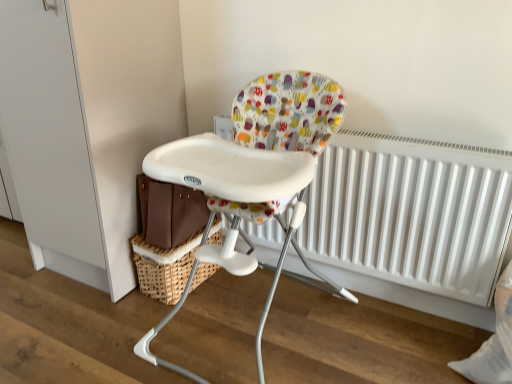
Question: Would you say white matte radiator at center is inside or outside woven brown basket at lower left?

Choices:
 (A) inside
 (B) outside

Answer: (B)

Question: From a real-world perspective, is white matte radiator at center physically located above or below woven brown basket at lower left?

Choices:
 (A) below
 (B) above

Answer: (B)

Question: Which of these objects is positioned closest to the woven brown basket at lower left?

Choices:
 (A) white matte radiator at center
 (B) white plastic highchair at center

Answer: (B)

Question: Which object is positioned closest to the white plastic highchair at center?

Choices:
 (A) woven brown basket at lower left
 (B) white matte radiator at center

Answer: (A)